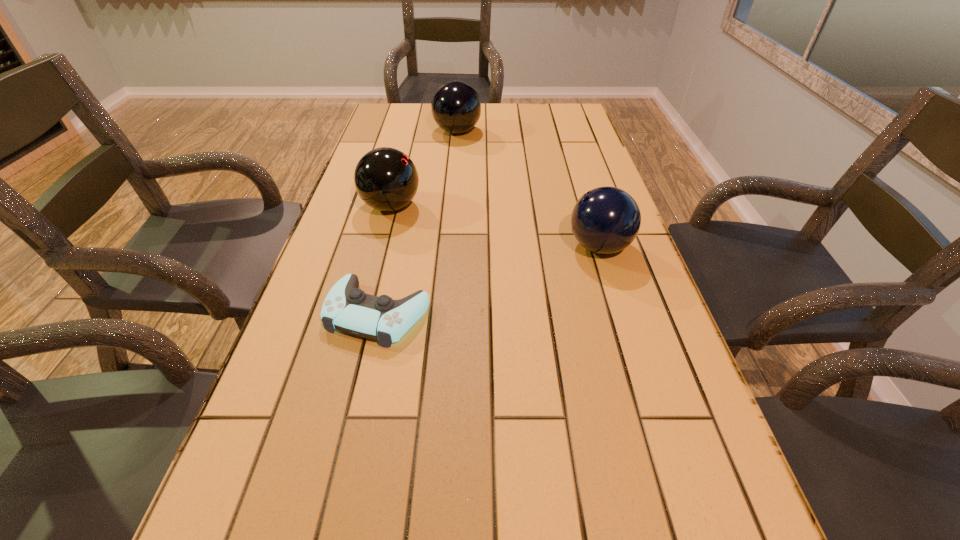
Find the location of a particular element. This screenshot has width=960, height=540. the farthest bowling ball is located at coordinates (x=456, y=108).

You are a GUI agent. You are given a task and a screenshot of the screen. Output one action in this format:
    pyautogui.click(x=<x>, y=<y>)
    Task: Click on the third nearest object
    
    Given the screenshot: What is the action you would take?
    pyautogui.click(x=386, y=179)

This screenshot has width=960, height=540. I want to click on the rightmost bowling ball, so click(x=605, y=220).

Locate an element on the screen. Image resolution: width=960 pixels, height=540 pixels. the nearest bowling ball is located at coordinates (605, 220).

This screenshot has height=540, width=960. Identify the location of the nearest object. (346, 308).

Locate an element on the screen. the shortest object is located at coordinates (346, 308).

Identify the location of vacant region located on the side of the farthest bowling ball with the finger holes. (500, 132).

Identify the location of free spot located 0.310m on the surface of the second nearest bowling ball near the finger holes. This screenshot has height=540, width=960. (532, 206).

Identify the location of free space located 0.270m on the surface of the rightmost object near the finger holes. (460, 247).

Find the location of a particular element. vacant space situated 0.210m on the surface of the rightmost object near the finger holes is located at coordinates (484, 247).